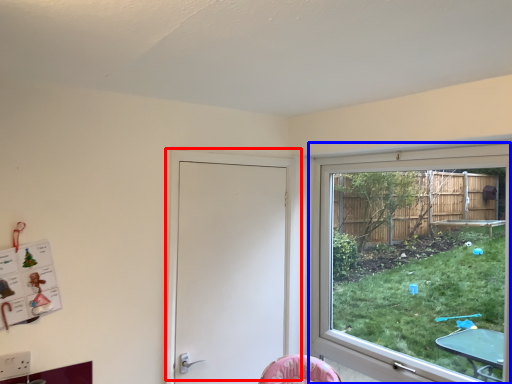
Question: Which object appears closest to the camera in this image, door (highlighted by a red box) or window (highlighted by a blue box)?

Choices:
 (A) door
 (B) window

Answer: (B)